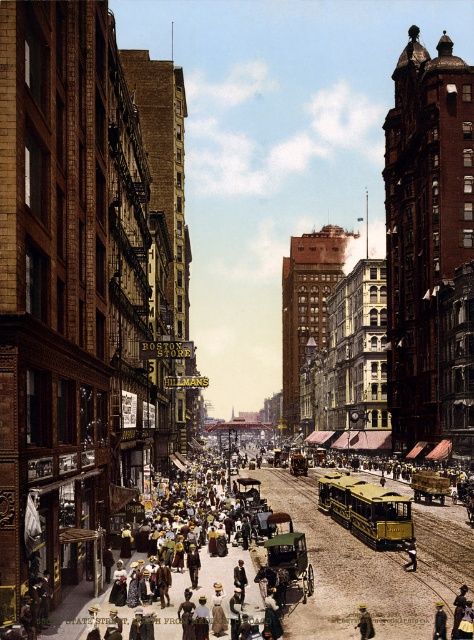
You are standing on a high vantage point overlooking the bustling urban street scene. You notice a light brown leather hat at center. Where exactly is the light brown leather hat located in terms of coordinates?

The light brown leather hat at center is located at coordinates point (364,621).

You are standing at the top of a tall building overlooking the street. You notice two points marked on the scene. From your vantage point, which of the two points, point (x=367, y=616) or point (x=437, y=627), is closer to you?

Point (x=367, y=616) is closer to you because it is further to the viewer than point (x=437, y=627).